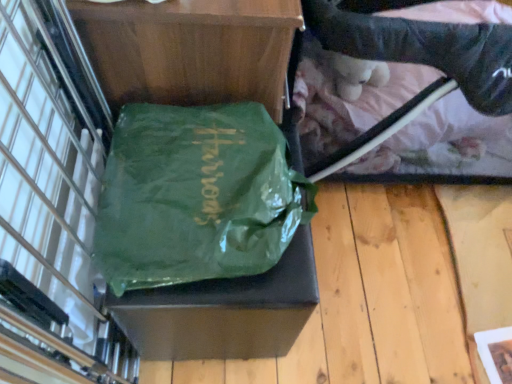
Question: Is black plastic baby carriage at upper right bigger or smaller than green shiny tote bag at center?

Choices:
 (A) big
 (B) small

Answer: (A)

Question: Considering the positions of black plastic baby carriage at upper right and green shiny tote bag at center in the image, is black plastic baby carriage at upper right wider or thinner than green shiny tote bag at center?

Choices:
 (A) thin
 (B) wide

Answer: (B)

Question: From their relative heights in the image, would you say black plastic baby carriage at upper right is taller or shorter than green shiny tote bag at center?

Choices:
 (A) short
 (B) tall

Answer: (B)

Question: Looking at their shapes, would you say green shiny tote bag at center is wider or thinner than black plastic baby carriage at upper right?

Choices:
 (A) wide
 (B) thin

Answer: (B)

Question: Is green shiny tote bag at center inside the boundaries of black plastic baby carriage at upper right, or outside?

Choices:
 (A) inside
 (B) outside

Answer: (B)

Question: From a real-world perspective, is green shiny tote bag at center positioned above or below black plastic baby carriage at upper right?

Choices:
 (A) below
 (B) above

Answer: (B)

Question: Looking at the image, does green shiny tote bag at center seem bigger or smaller compared to black plastic baby carriage at upper right?

Choices:
 (A) big
 (B) small

Answer: (B)